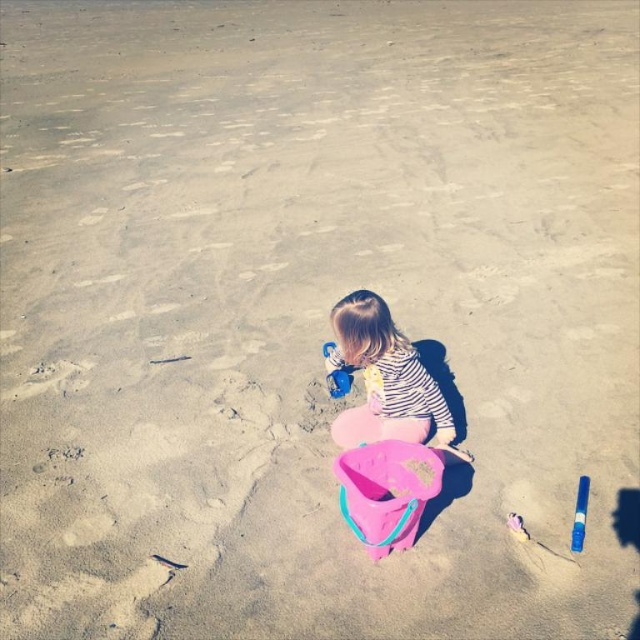
Question: Among these points, which one is nearest to the camera?

Choices:
 (A) (520, 536)
 (B) (330, 344)
 (C) (577, 508)

Answer: (A)

Question: Which point appears closest to the camera in this image?

Choices:
 (A) (426, 417)
 (B) (579, 499)

Answer: (B)

Question: Which point is farther to the camera?

Choices:
 (A) (509, 522)
 (B) (336, 346)
 (C) (579, 492)

Answer: (B)

Question: Is striped fabric child at center bigger than blue plastic marker at lower right?

Choices:
 (A) yes
 (B) no

Answer: (A)

Question: Can you confirm if striped fabric child at center is positioned above pink plastic bucket at center?

Choices:
 (A) no
 (B) yes

Answer: (B)

Question: Is pink plastic bucket at center positioned behind blue plastic bucket at center?

Choices:
 (A) yes
 (B) no

Answer: (B)